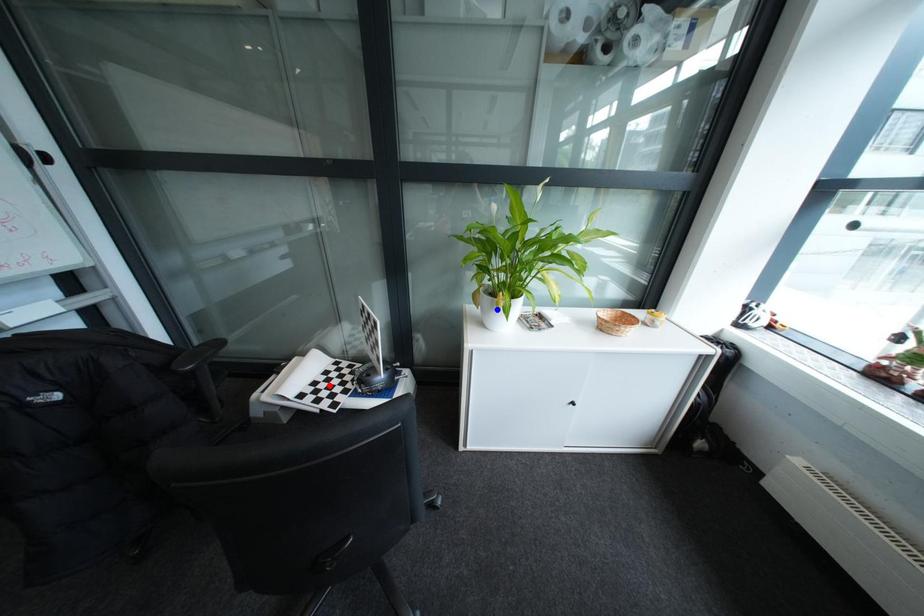
Question: Two points are marked on the image. Which point is closer to the camera?

Choices:
 (A) Blue point is closer.
 (B) Red point is closer.

Answer: (A)